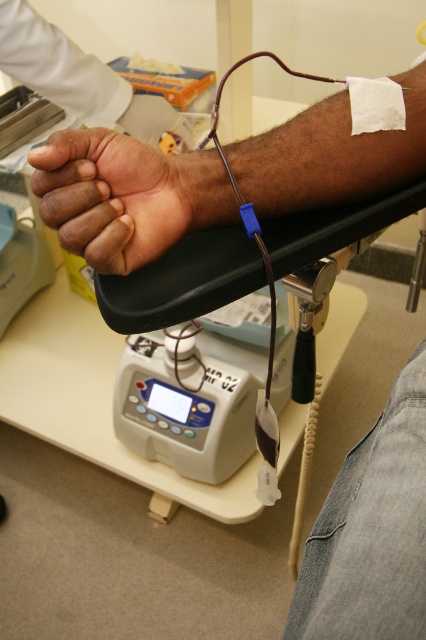
Question: Is dark skin arm at upper center thinner than dark skin palm at center?

Choices:
 (A) yes
 (B) no

Answer: (B)

Question: Can you confirm if dark skin arm at upper center is positioned to the right of dark skin palm at center?

Choices:
 (A) no
 (B) yes

Answer: (B)

Question: Does dark skin arm at upper center appear on the right side of dark skin palm at center?

Choices:
 (A) no
 (B) yes

Answer: (B)